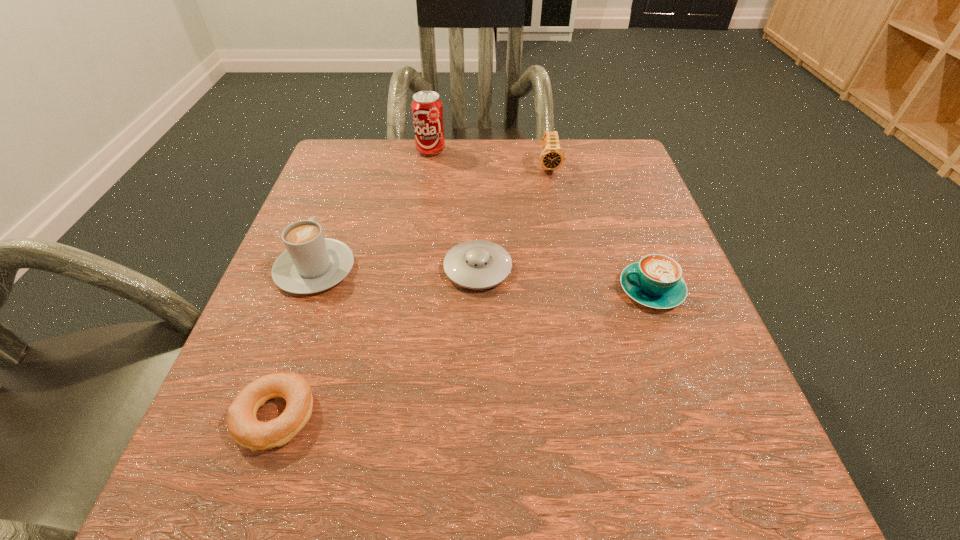
Locate an element on the screen. Image resolution: width=960 pixels, height=540 pixels. soda is located at coordinates (427, 111).

Where is `the third object from left to right`? The image size is (960, 540). the third object from left to right is located at coordinates (427, 111).

The image size is (960, 540). I want to click on the left cappuccino, so click(311, 263).

Locate an element on the screen. watch is located at coordinates (x=552, y=157).

The image size is (960, 540). I want to click on the right cappuccino, so click(656, 281).

Locate an element on the screen. This screenshot has height=540, width=960. the rightmost object is located at coordinates (656, 281).

You are a GUI agent. You are given a task and a screenshot of the screen. Output one action in this format:
    pyautogui.click(x=<x>, y=<y>)
    Task: Click on the third object from right to left
    The image size is (960, 540).
    Given the screenshot: What is the action you would take?
    pyautogui.click(x=477, y=264)

At what (x,y) coordinates should I click in order to perform the action: click on bagel. Please return your answer as a coordinate pair (x, y). This screenshot has width=960, height=540. Looking at the image, I should click on (247, 431).

Identify the location of vacant point located 0.110m on the left of the fourth object from right to left. Image resolution: width=960 pixels, height=540 pixels. (371, 151).

Find the location of a particular element. Image resolution: width=960 pixels, height=540 pixels. free location located 0.220m to the right of the taller cappuccino is located at coordinates click(348, 177).